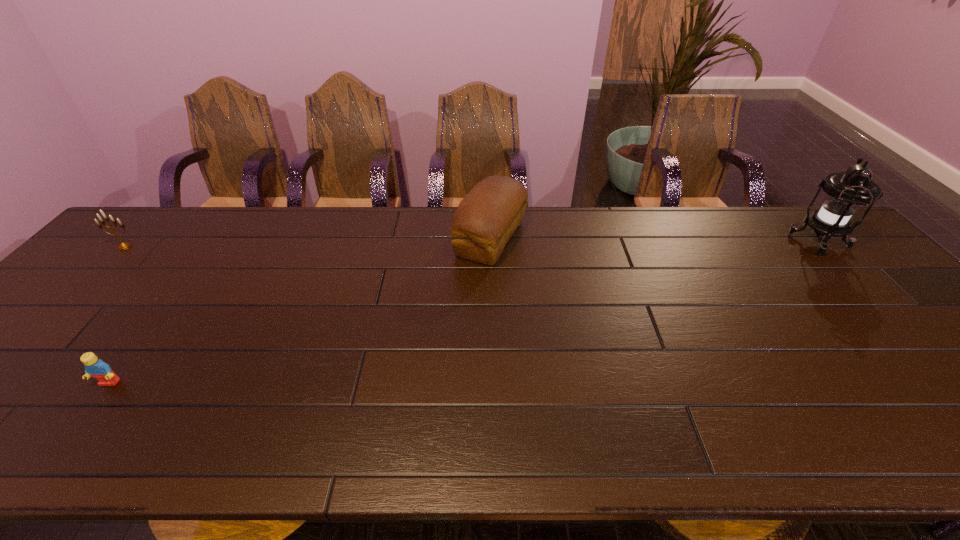
Where is `free space located 0.190m on the right of the candelabrum`? This screenshot has height=540, width=960. free space located 0.190m on the right of the candelabrum is located at coordinates (201, 247).

Where is `free point located on the face of the nearest object`? This screenshot has width=960, height=540. free point located on the face of the nearest object is located at coordinates (56, 455).

This screenshot has width=960, height=540. Identify the location of lantern located in the far edge section of the desktop. (846, 191).

Identify the location of bread present at the far edge. (488, 216).

Locate an element on the screen. The image size is (960, 540). candelabrum present at the far edge is located at coordinates (123, 246).

Identify the location of object that is at the left edge. (123, 246).

At what (x,y) coordinates should I click in order to perform the action: click on object that is at the right edge. Please return your answer as a coordinate pair (x, y). The height and width of the screenshot is (540, 960). Looking at the image, I should click on (846, 191).

I want to click on object at the far left corner, so tap(123, 246).

Find the location of a particular element. object that is at the far right corner is located at coordinates (846, 191).

Where is `vacant region at the far edge of the desktop`? This screenshot has width=960, height=540. vacant region at the far edge of the desktop is located at coordinates (420, 231).